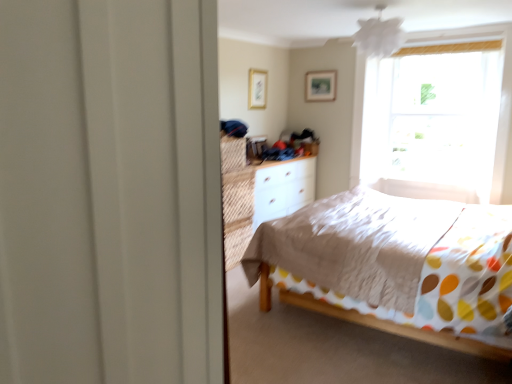
Describe the element at coordinates (257, 89) in the screenshot. This screenshot has width=512, height=384. I see `wooden picture frame at upper center, the 1th picture frame positioned from the front` at that location.

The width and height of the screenshot is (512, 384). I want to click on wooden picture frame at upper center, the first picture frame from the right, so click(x=320, y=86).

From the picture: Between wooden picture frame at upper center, the first picture frame from the right, and wooden picture frame at upper center, the first picture frame positioned from the left, which one is positioned in front?

wooden picture frame at upper center, the first picture frame positioned from the left.

Could you tell me if wooden picture frame at upper center, the second picture frame positioned from the front, is turned towards wooden picture frame at upper center, positioned as the 2th picture frame in right-to-left order?

Yes, wooden picture frame at upper center, the second picture frame positioned from the front, is facing wooden picture frame at upper center, positioned as the 2th picture frame in right-to-left order.

What's the angular difference between wooden picture frame at upper center, the first picture frame from the right, and wooden picture frame at upper center, positioned as the 2th picture frame in right-to-left order,'s facing directions?

The angular difference between wooden picture frame at upper center, the first picture frame from the right, and wooden picture frame at upper center, positioned as the 2th picture frame in right-to-left order, is 90.7 degrees.

Considering the relative sizes of white matte dresser at center and wooden picture frame at upper center, the second picture frame positioned from the front, in the image provided, is white matte dresser at center wider than wooden picture frame at upper center, the second picture frame positioned from the front,?

Correct, the width of white matte dresser at center exceeds that of wooden picture frame at upper center, the second picture frame positioned from the front.

What's the angular difference between white matte dresser at center and wooden picture frame at upper center, the first picture frame from the right,'s facing directions?

There is a 92.2-degree angle between the facing directions of white matte dresser at center and wooden picture frame at upper center, the first picture frame from the right.

Which of these two, white matte dresser at center or wooden picture frame at upper center, the second picture frame from the left, is bigger?

With larger size is white matte dresser at center.

Considering the positions of points (253, 103) and (316, 73), is point (253, 103) farther from camera compared to point (316, 73)?

No, (253, 103) is closer to viewer.

From the image's perspective, which one is positioned higher, wooden picture frame at upper center, which appears as the second picture frame when viewed from the back, or wooden picture frame at upper center, the first picture frame from the right?

wooden picture frame at upper center, the first picture frame from the right, is shown above in the image.

Based on the photo, measure the distance between wooden picture frame at upper center, the first picture frame positioned from the left, and wooden picture frame at upper center, the second picture frame from the left.

wooden picture frame at upper center, the first picture frame positioned from the left, and wooden picture frame at upper center, the second picture frame from the left, are 25.57 inches apart.

From the picture: Who is shorter, wooden picture frame at upper center, positioned as the 2th picture frame in right-to-left order, or wooden picture frame at upper center, the first picture frame from the right?

wooden picture frame at upper center, the first picture frame from the right, is shorter.

Is wooden picture frame at upper center, the first picture frame from the right, at the left side of white matte dresser at center?

No, wooden picture frame at upper center, the first picture frame from the right, is not to the left of white matte dresser at center.

Considering the relative sizes of wooden picture frame at upper center, the first picture frame from the back, and white matte dresser at center in the image provided, is wooden picture frame at upper center, the first picture frame from the back, shorter than white matte dresser at center?

Correct, wooden picture frame at upper center, the first picture frame from the back, is not as tall as white matte dresser at center.

From a real-world perspective, which object rests below the other?

From a 3D spatial view, white matte dresser at center is below.

Is wooden picture frame at upper center, the first picture frame from the back, spatially inside white matte dresser at center, or outside of it?

wooden picture frame at upper center, the first picture frame from the back, is not enclosed by white matte dresser at center.

Can you confirm if white textured bed at center is shorter than wooden picture frame at upper center, the second picture frame positioned from the front?

In fact, white textured bed at center may be taller than wooden picture frame at upper center, the second picture frame positioned from the front.

Between white textured bed at center and wooden picture frame at upper center, the first picture frame from the back, which one appears on the left side from the viewer's perspective?

wooden picture frame at upper center, the first picture frame from the back.

Is point (453, 317) positioned before point (322, 74)?

Yes, point (453, 317) is in front of point (322, 74).

Is white matte dresser at center to the left of white textured bed at center from the viewer's perspective?

Indeed, white matte dresser at center is positioned on the left side of white textured bed at center.

Can you confirm if white matte dresser at center is shorter than white textured bed at center?

Indeed, white matte dresser at center has a lesser height compared to white textured bed at center.

Can you see white matte dresser at center touching white textured bed at center?

No, white matte dresser at center is not with white textured bed at center.

Locate an element on the screen. The width and height of the screenshot is (512, 384). dresser located on the left of white textured bed at center is located at coordinates (259, 194).

Based on the photo, what's the angular difference between wooden picture frame at upper center, which appears as the second picture frame when viewed from the back, and white textured bed at center's facing directions?

180 degrees separate the facing orientations of wooden picture frame at upper center, which appears as the second picture frame when viewed from the back, and white textured bed at center.

From the image's perspective, between wooden picture frame at upper center, the first picture frame positioned from the left, and white textured bed at center, who is located below?

white textured bed at center.

Is point (260, 76) less distant than point (355, 275)?

No.

Looking at this image, which object is more forward, wooden picture frame at upper center, the 1th picture frame positioned from the front, or white textured bed at center?

white textured bed at center is closer to the camera.

I want to click on picture frame behind the wooden picture frame at upper center, which appears as the second picture frame when viewed from the back, so click(320, 86).

This screenshot has height=384, width=512. Identify the location of picture frame lying on the right of white matte dresser at center. (320, 86).

Which object lies nearer to the anchor point wooden picture frame at upper center, the first picture frame positioned from the left, white textured bed at center or wooden picture frame at upper center, the first picture frame from the back?

Based on the image, wooden picture frame at upper center, the first picture frame from the back, appears to be nearer to wooden picture frame at upper center, the first picture frame positioned from the left.

Based on their spatial positions, is wooden picture frame at upper center, the second picture frame positioned from the front, or white textured bed at center closer to wooden picture frame at upper center, the first picture frame positioned from the left?

wooden picture frame at upper center, the second picture frame positioned from the front, is closer to wooden picture frame at upper center, the first picture frame positioned from the left.

Estimate the real-world distances between objects in this image. Which object is closer to white matte dresser at center, wooden picture frame at upper center, the second picture frame from the left, or white textured bed at center?

The object closer to white matte dresser at center is white textured bed at center.

Estimate the real-world distances between objects in this image. Which object is closer to white matte dresser at center, wooden picture frame at upper center, the first picture frame positioned from the left, or white textured bed at center?

Among the two, wooden picture frame at upper center, the first picture frame positioned from the left, is located nearer to white matte dresser at center.

Considering their positions, is white textured bed at center positioned closer to wooden picture frame at upper center, the first picture frame from the right, than wooden picture frame at upper center, positioned as the 2th picture frame in right-to-left order?

The object closer to wooden picture frame at upper center, the first picture frame from the right, is wooden picture frame at upper center, positioned as the 2th picture frame in right-to-left order.

From the image, which object appears to be nearer to white textured bed at center, wooden picture frame at upper center, the first picture frame from the back, or white matte dresser at center?

Among the two, white matte dresser at center is located nearer to white textured bed at center.

From the picture: Considering their positions, is wooden picture frame at upper center, the first picture frame positioned from the left, positioned closer to white matte dresser at center than wooden picture frame at upper center, the second picture frame positioned from the front?

wooden picture frame at upper center, the first picture frame positioned from the left, is closer to white matte dresser at center.

Looking at the image, which one is located further to white textured bed at center, wooden picture frame at upper center, the first picture frame positioned from the left, or wooden picture frame at upper center, the second picture frame positioned from the front?

wooden picture frame at upper center, the second picture frame positioned from the front.

The height and width of the screenshot is (384, 512). Find the location of `dresser between white textured bed at center and wooden picture frame at upper center, the 1th picture frame positioned from the front, in the front-back direction`. dresser between white textured bed at center and wooden picture frame at upper center, the 1th picture frame positioned from the front, in the front-back direction is located at coordinates point(259,194).

Where is `dresser located between white textured bed at center and wooden picture frame at upper center, the second picture frame positioned from the front, in the depth direction`? dresser located between white textured bed at center and wooden picture frame at upper center, the second picture frame positioned from the front, in the depth direction is located at coordinates (259, 194).

The width and height of the screenshot is (512, 384). Find the location of `picture frame between white textured bed at center and wooden picture frame at upper center, the second picture frame from the left, in the front-back direction`. picture frame between white textured bed at center and wooden picture frame at upper center, the second picture frame from the left, in the front-back direction is located at coordinates (257, 89).

Find the location of a particular element. The height and width of the screenshot is (384, 512). picture frame between wooden picture frame at upper center, the first picture frame from the back, and white matte dresser at center from top to bottom is located at coordinates (257, 89).